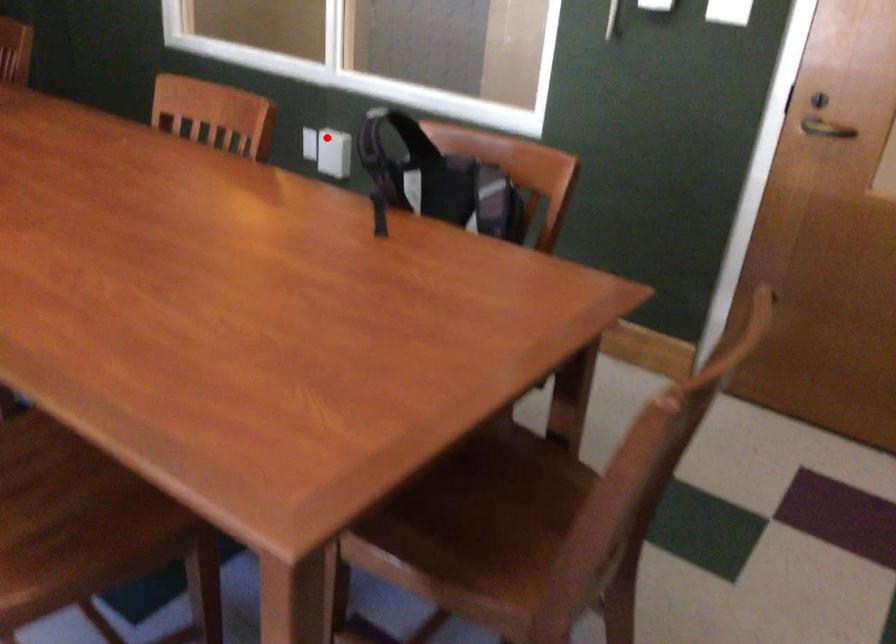
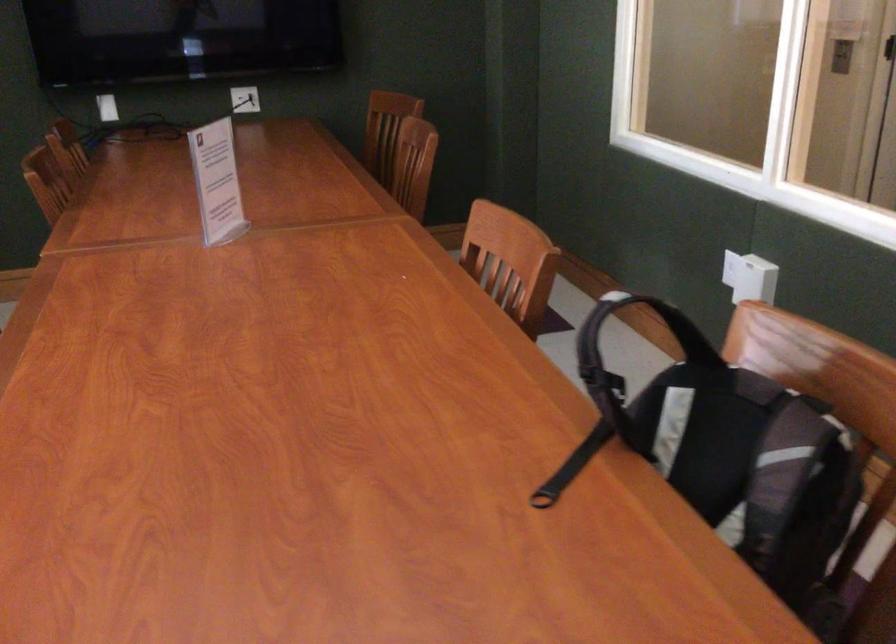
Question: I am providing you with two images of the same scene from different viewpoints. Given a red point in image1, look at the same physical point in image2. Is it:

Choices:
 (A) Closer to the viewpoint
 (B) Farther from the viewpoint

Answer: (A)